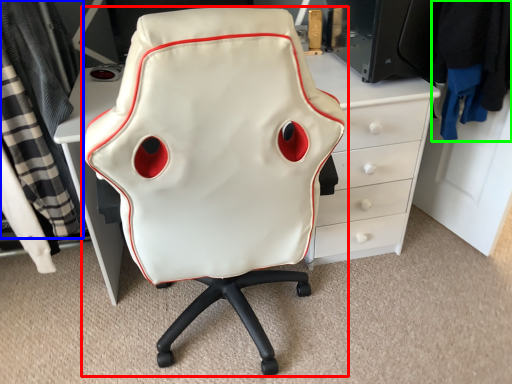
Question: Which is nearer to the chair (highlighted by a red box)? clothing (highlighted by a blue box) or clothing (highlighted by a green box).

Choices:
 (A) clothing
 (B) clothing

Answer: (A)